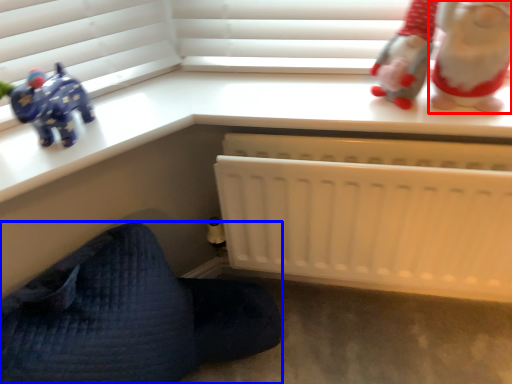
Question: Which point is further to the camera, toy (highlighted by a red box) or furniture (highlighted by a blue box)?

Choices:
 (A) toy
 (B) furniture

Answer: (A)